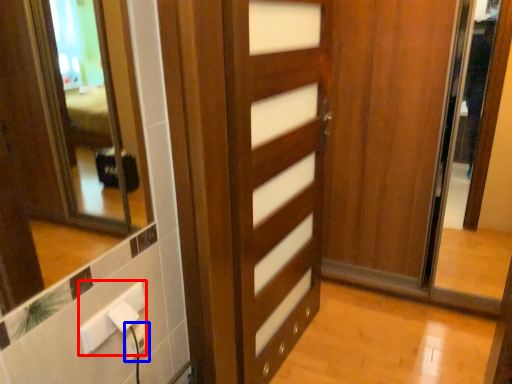
Question: Which point is further to the camera, electric outlet (highlighted by a red box) or electric outlet (highlighted by a blue box)?

Choices:
 (A) electric outlet
 (B) electric outlet

Answer: (B)